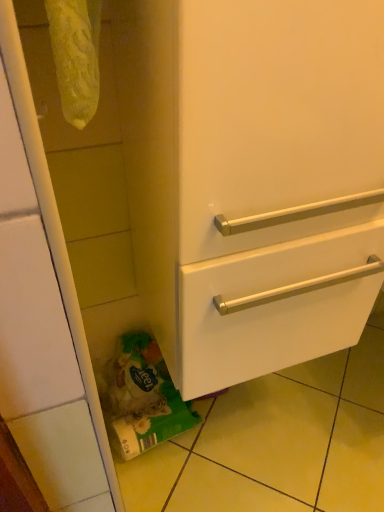
Question: From a real-world perspective, relative to white glossy drawer at lower right, is green matte plastic bag at lower left vertically above or below?

Choices:
 (A) below
 (B) above

Answer: (A)

Question: From the image's perspective, relative to white glossy drawer at lower right, is green matte plastic bag at lower left above or below?

Choices:
 (A) above
 (B) below

Answer: (B)

Question: From their relative heights in the image, would you say green matte plastic bag at lower left is taller or shorter than white glossy drawer at lower right?

Choices:
 (A) short
 (B) tall

Answer: (A)

Question: Is white glossy drawer at lower right in front of or behind green matte plastic bag at lower left in the image?

Choices:
 (A) front
 (B) behind

Answer: (A)

Question: Based on their positions, is white glossy drawer at lower right located to the left or right of green matte plastic bag at lower left?

Choices:
 (A) left
 (B) right

Answer: (B)

Question: In terms of width, does white glossy drawer at lower right look wider or thinner when compared to green matte plastic bag at lower left?

Choices:
 (A) thin
 (B) wide

Answer: (B)

Question: From a real-world perspective, relative to green matte plastic bag at lower left, is white glossy drawer at lower right vertically above or below?

Choices:
 (A) below
 (B) above

Answer: (B)